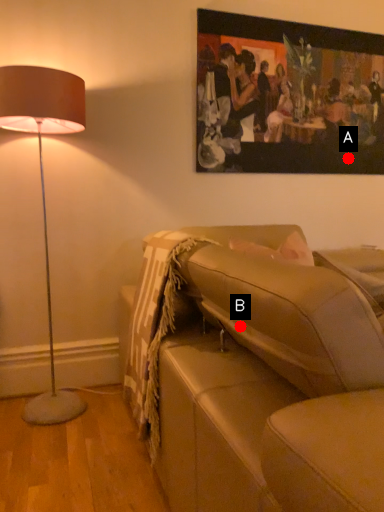
Question: Two points are circled on the image, labeled by A and B beside each circle. Which point is closer to the camera taking this photo?

Choices:
 (A) A is closer
 (B) B is closer

Answer: (B)